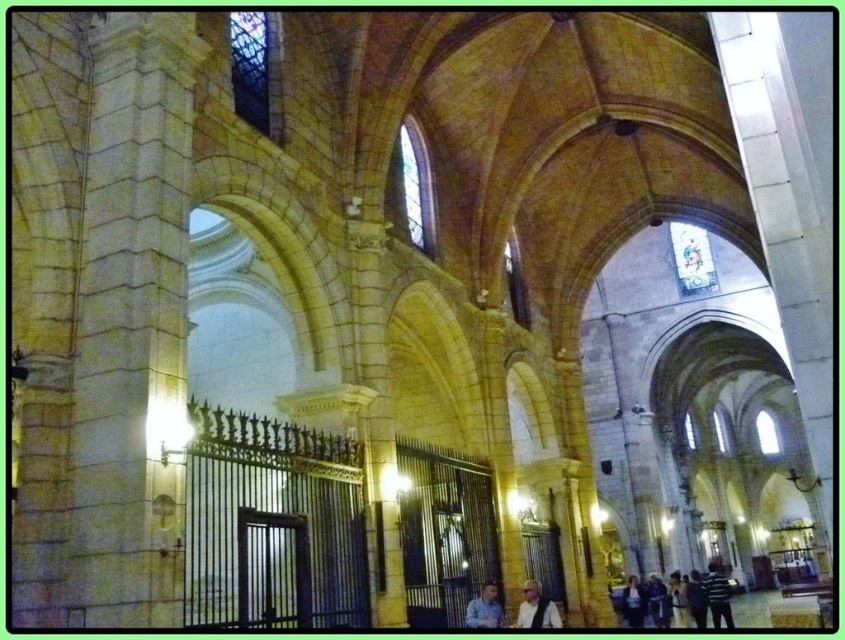
You are standing in the grand cathedral with high vaulted ceilings and stained glass windows. You notice an object labeled as dark blue jeans at lower right. Based on its coordinates, can you estimate its location relative to the center of the cathedral?

The dark blue jeans at lower right is located at coordinates point (657, 600), which places it near the lower right corner of the cathedral, far from the center.

You are a visitor in the cathedral and want to sit on a bench that is 1.2 meters wide. You have two items with you, the light brown leather jacket at lower center and the blue shirt at center. Which item can you place on the bench without folding it?

The light brown leather jacket at lower center has a larger width than the blue shirt at center, so it can be placed on the bench without folding as it requires more space.